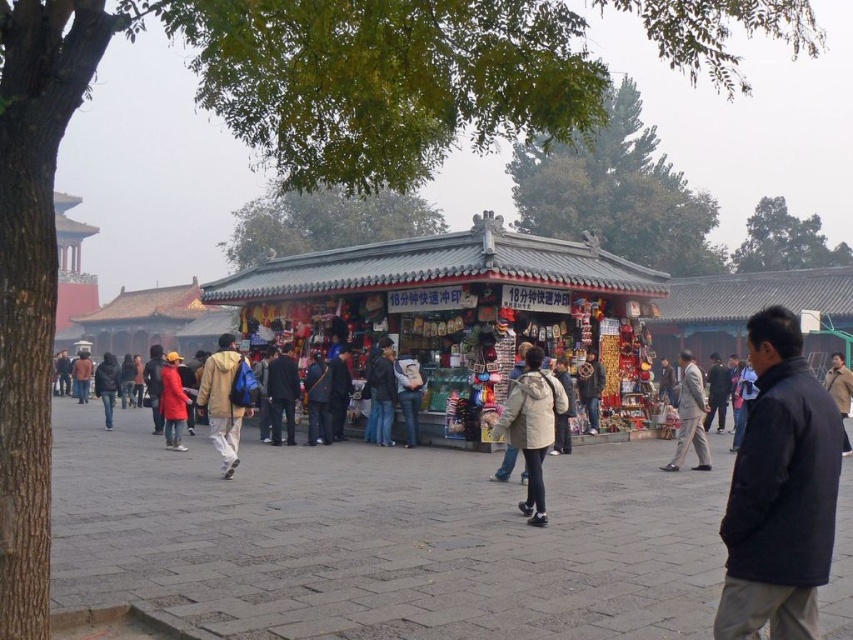
Is dark blue jacket at center taller than red matte coat at center?

Yes.

Is dark blue jacket at center smaller than red matte coat at center?

Yes, dark blue jacket at center is smaller than red matte coat at center.

Describe the element at coordinates (282, 394) in the screenshot. I see `dark blue jacket at center` at that location.

The height and width of the screenshot is (640, 853). Identify the location of dark blue jacket at center. (282, 394).

Can you confirm if black matte jacket at lower right is positioned to the left of light beige jacket at center?

In fact, black matte jacket at lower right is to the right of light beige jacket at center.

Between black matte jacket at lower right and light beige jacket at center, which one appears on the right side from the viewer's perspective?

black matte jacket at lower right

In order to click on black matte jacket at lower right in this screenshot , I will do `click(779, 492)`.

Does light brown fabric jacket at center have a greater height compared to dark blue jeans at center?

Correct, light brown fabric jacket at center is much taller as dark blue jeans at center.

Looking at this image, can you confirm if light brown fabric jacket at center is positioned below dark blue jeans at center?

No.

Which is in front, point (236, 417) or point (107, 390)?

Point (236, 417) is more forward.

Find the location of a particular element. The width and height of the screenshot is (853, 640). light brown fabric jacket at center is located at coordinates tap(222, 401).